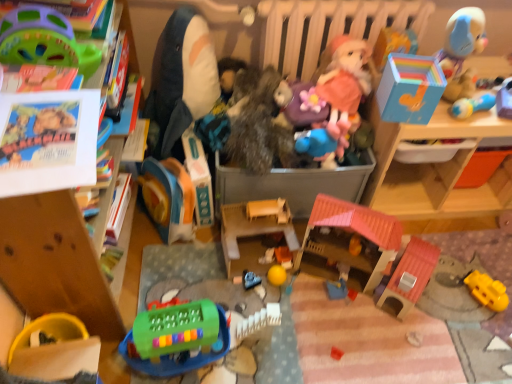
Locate an element on the screen. vacant area situated to the left side of yellow plastic blocks at lower right, the 2th toy from the right is located at coordinates (445, 302).